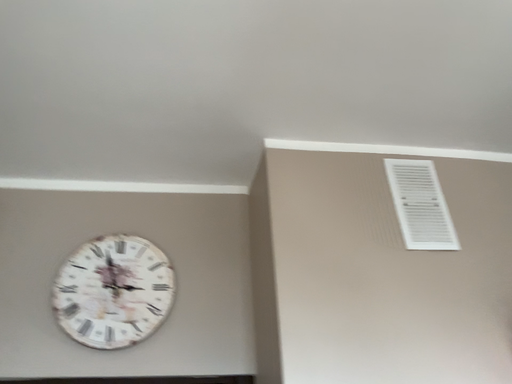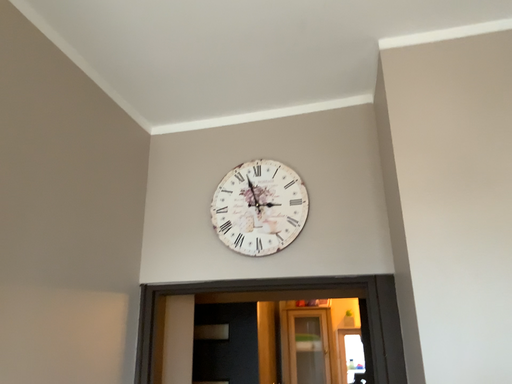
Question: How did the camera likely rotate when shooting the video?

Choices:
 (A) rotated upward
 (B) rotated downward

Answer: (B)